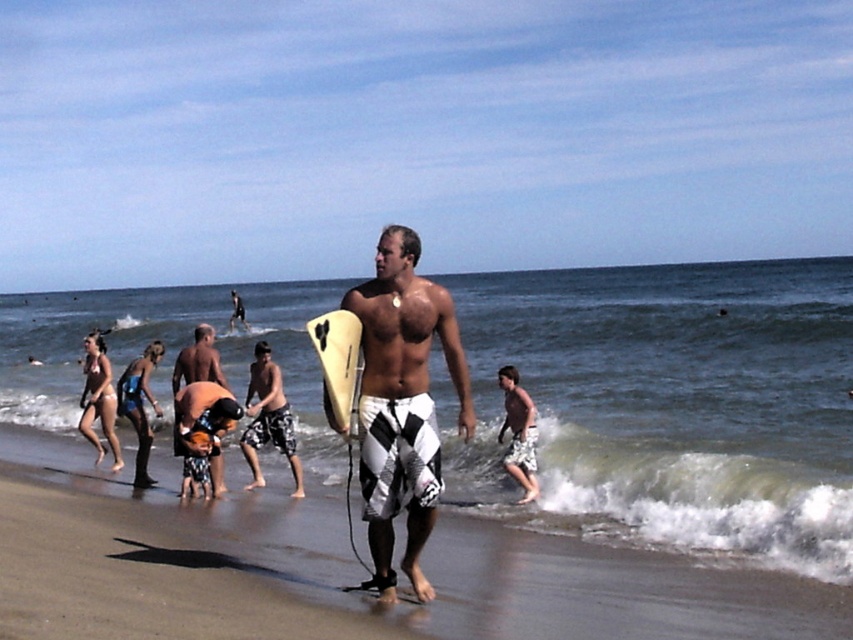
You are a photographer trying to capture the man in the white checkered boardshorts at center and the matte black surfboard at center in a single shot. Based on their sizes, which object should you focus on first to ensure both are in frame?

The white checkered boardshorts at center is shorter than the matte black surfboard at center, so you should focus on the matte black surfboard at center first to ensure both are in frame.

In the scene shown: You are a photographer standing at the beach scene. You want to take a photo of the white checkered boardshorts at center. Where exactly should you aim your camera to capture it?

You should aim your camera at the point with coordinates 0.633 on the x axis and 0.472 on the y axis to capture the white checkered boardshorts at center.